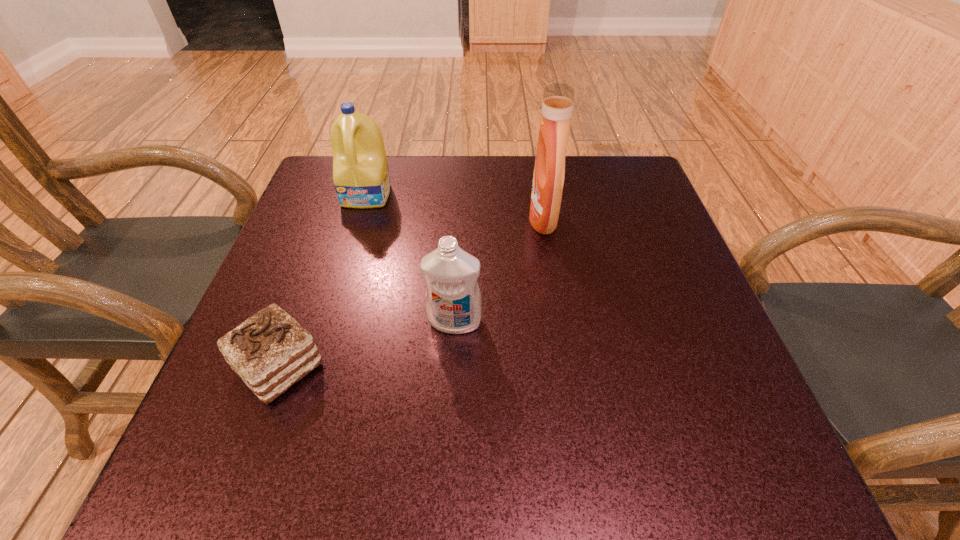
The width and height of the screenshot is (960, 540). In order to click on vacant region located on the back of the second detergent from right to left in this screenshot , I will do `click(461, 210)`.

In order to click on blank space located 0.050m on the back of the shortest object in this screenshot , I will do `click(300, 310)`.

Identify the location of detergent that is at the left edge. (361, 177).

Find the location of `chocolate cake located in the left edge section of the desktop`. chocolate cake located in the left edge section of the desktop is located at coordinates (270, 351).

Find the location of a particular element. This screenshot has width=960, height=540. object situated at the far left corner is located at coordinates (361, 177).

In the image, there is a desktop. At what (x,y) coordinates should I click in order to perform the action: click on vacant space at the far edge. Please return your answer as a coordinate pair (x, y). Looking at the image, I should click on (453, 192).

I want to click on blank space at the near edge, so click(563, 474).

In the image, there is a desktop. Identify the location of vacant space at the left edge. This screenshot has height=540, width=960. (348, 228).

Find the location of a particular element. The height and width of the screenshot is (540, 960). vacant region at the right edge of the desktop is located at coordinates (626, 313).

This screenshot has width=960, height=540. Find the location of `vacant region at the far right corner of the desktop`. vacant region at the far right corner of the desktop is located at coordinates (620, 173).